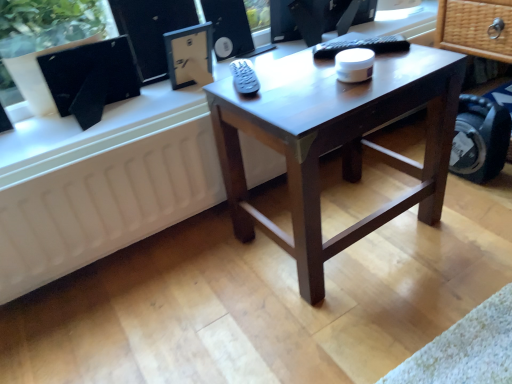
The height and width of the screenshot is (384, 512). Find the location of `vacant area that is in front of matte dark brown coffee table at center`. vacant area that is in front of matte dark brown coffee table at center is located at coordinates (373, 319).